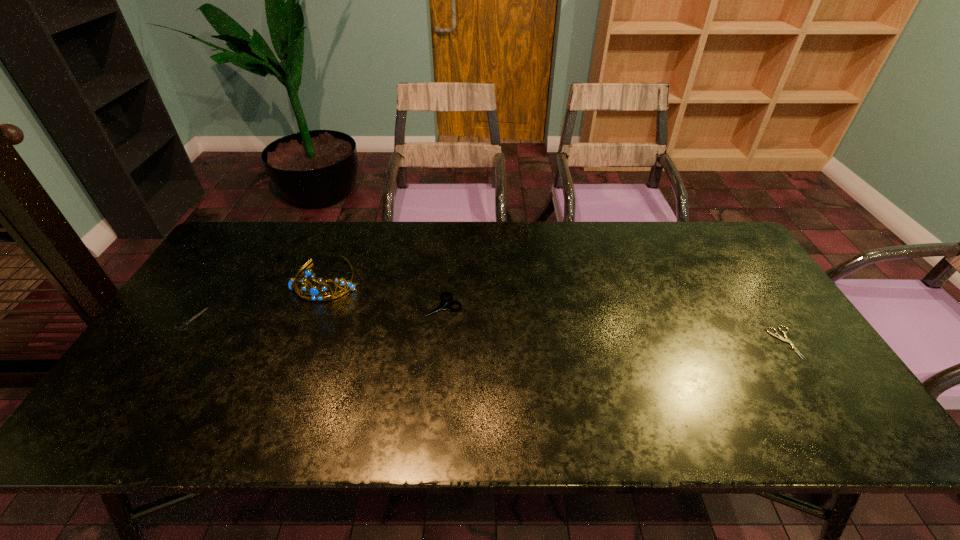
Where is `object that is at the far edge`? This screenshot has height=540, width=960. object that is at the far edge is located at coordinates (316, 293).

Find the location of `object located at the left edge`. object located at the left edge is located at coordinates (186, 323).

You are a GUI agent. You are given a task and a screenshot of the screen. Output one action in this format:
    pyautogui.click(x=<x>, y=<y>)
    Task: Click on the object that is positioned at the right edge
    
    Given the screenshot: What is the action you would take?
    pyautogui.click(x=778, y=336)

The width and height of the screenshot is (960, 540). I want to click on free space at the far edge, so click(468, 249).

Where is `free space at the near edge of the desktop`? free space at the near edge of the desktop is located at coordinates (208, 440).

In the image, there is a desktop. Where is `vacant space at the left edge`? vacant space at the left edge is located at coordinates (222, 318).

What are the coordinates of `blank space at the right edge of the desktop` in the screenshot? It's located at [x=788, y=324].

In the image, there is a desktop. Identify the location of vacant space at the far left corner. (246, 254).

The image size is (960, 540). Identify the location of blank space at the near right corner of the desktop. (788, 408).

Identify the location of vacant space that is in between the leftmost object and the third shortest object. pos(317,313).